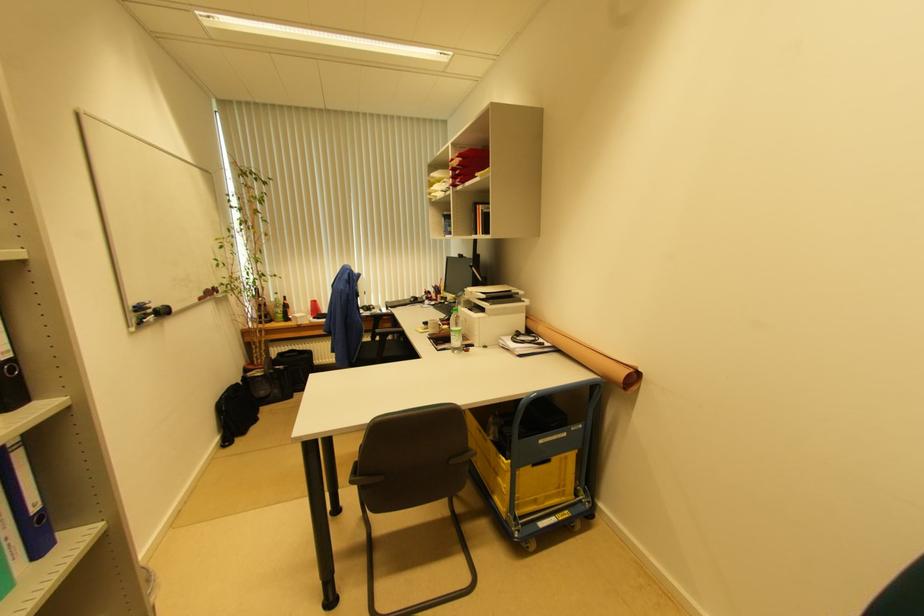
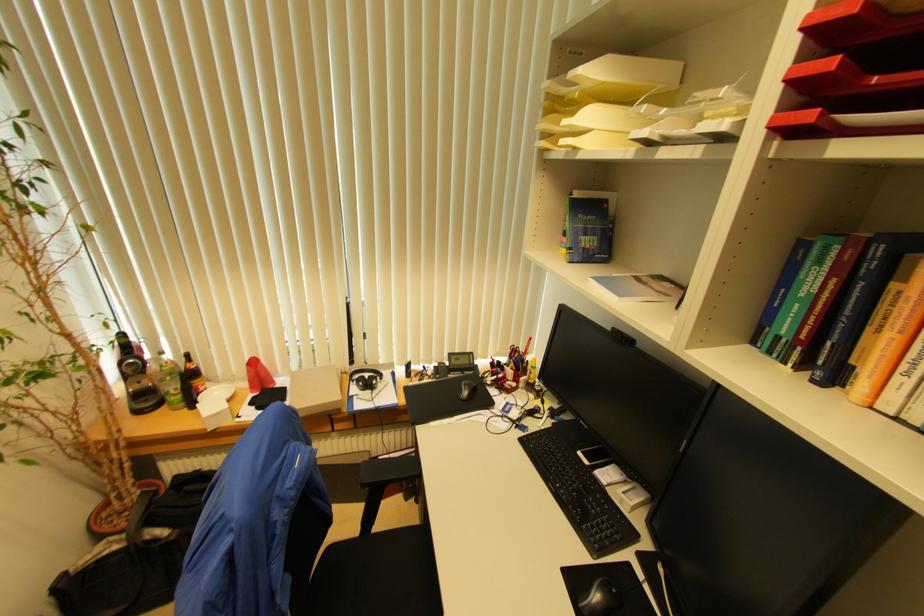
Locate, in the second image, the point that corresponds to [414,302] in the first image.

(467, 395)